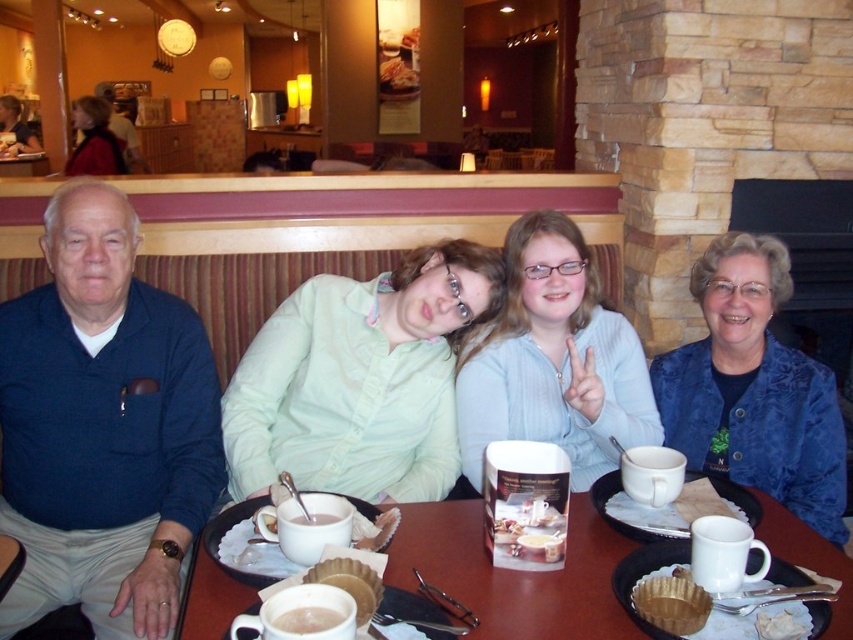
Question: Among these objects, which one is farthest from the camera?

Choices:
 (A) white matte coffee cup at lower center
 (B) blue textured jacket at upper right
 (C) baked paper cupcake liner at lower center
 (D) white ceramic mug at center

Answer: (B)

Question: Is baked paper cupcake liner at lower center further to the viewer compared to matte black jacket at upper left?

Choices:
 (A) no
 (B) yes

Answer: (A)

Question: From the image, what is the correct spatial relationship of light green shirt at center in relation to white matte coffee cup at lower center?

Choices:
 (A) right
 (B) left

Answer: (A)

Question: Can you confirm if blue textured jacket at upper right is bigger than white crumbly pastry at center?

Choices:
 (A) no
 (B) yes

Answer: (B)

Question: Based on their relative distances, which object is nearer to the matte black jacket at upper left?

Choices:
 (A) light green shirt at center
 (B) white matte coffee cup at lower center
 (C) blue textured jacket at upper right
 (D) white matte mug at center

Answer: (A)

Question: Among these objects, which one is farthest from the camera?

Choices:
 (A) blue textured jacket at upper right
 (B) matte black jacket at upper left
 (C) light blue sweater at center

Answer: (B)